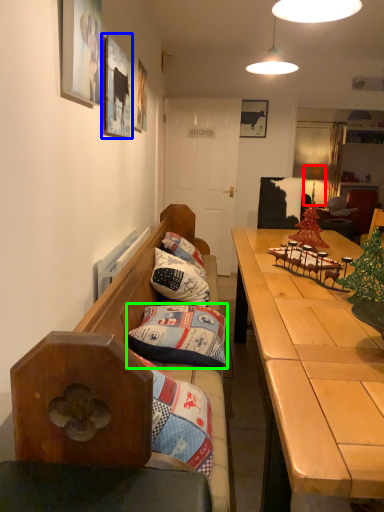
Question: Considering the real-world distances, which object is closest to lamp (highlighted by a red box)? picture frame (highlighted by a blue box) or pillow (highlighted by a green box).

Choices:
 (A) picture frame
 (B) pillow

Answer: (A)